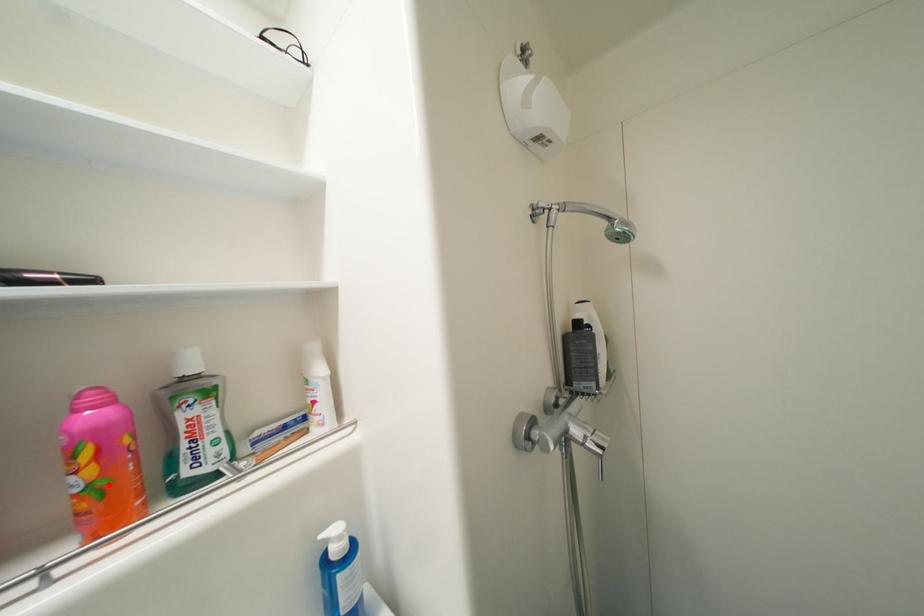
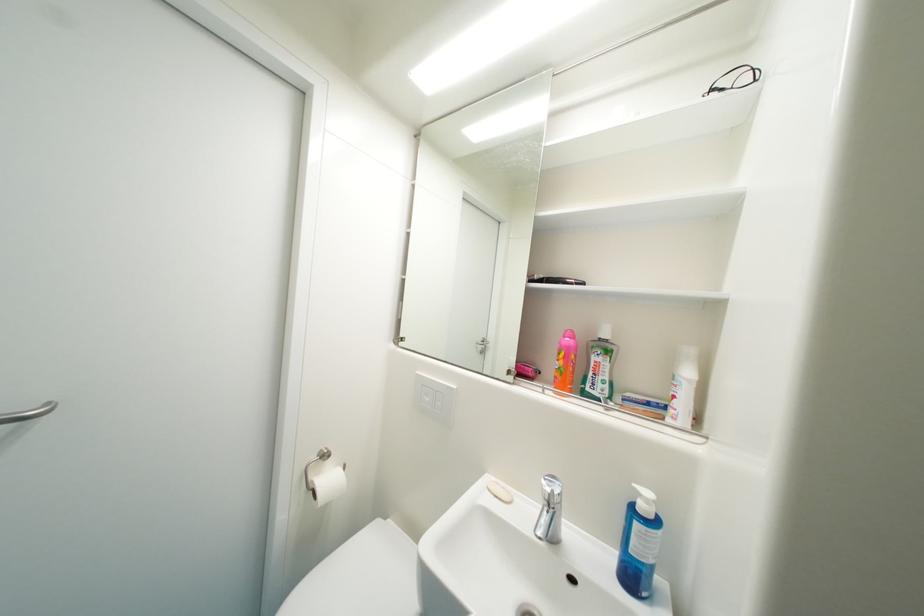
Locate, in the second image, the point that corresponds to the highlighted location in the first image.

(569, 371)